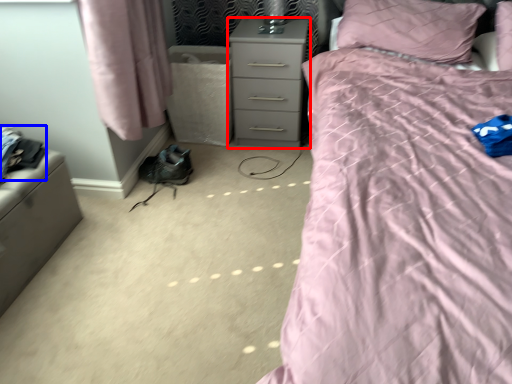
Question: Among these objects, which one is farthest to the camera, nightstand (highlighted by a red box) or clothing (highlighted by a blue box)?

Choices:
 (A) nightstand
 (B) clothing

Answer: (A)